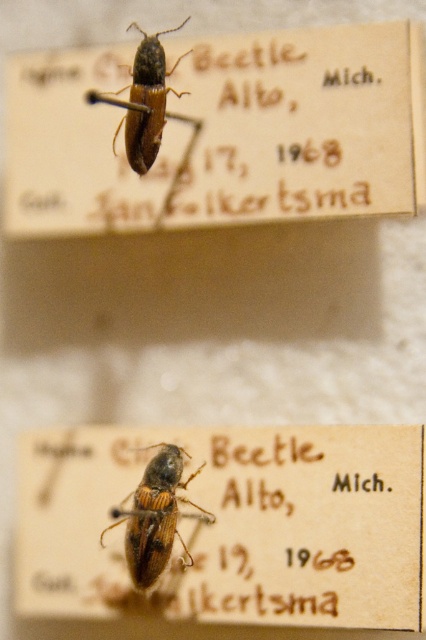
Does matte brown beetle at upper center appear over brown matte beetle at center?

Yes, matte brown beetle at upper center is above brown matte beetle at center.

Can you confirm if matte brown beetle at upper center is positioned to the right of brown matte beetle at center?

Correct, you'll find matte brown beetle at upper center to the right of brown matte beetle at center.

Where is `matte brown beetle at upper center`? The image size is (426, 640). matte brown beetle at upper center is located at coordinates (221, 132).

Consider the image. Does matte brown wood at center have a smaller size compared to shiny brown beetle at upper center?

No, matte brown wood at center is not smaller than shiny brown beetle at upper center.

Describe the element at coordinates (233, 525) in the screenshot. I see `matte brown wood at center` at that location.

Locate an element on the screen. This screenshot has height=640, width=426. matte brown wood at center is located at coordinates (233, 525).

Which is above, matte brown beetle at upper center or matte brown wood at center?

matte brown beetle at upper center is above.

Does point (28, 170) come behind point (69, 570)?

That is True.

Locate an element on the screen. matte brown beetle at upper center is located at coordinates (221, 132).